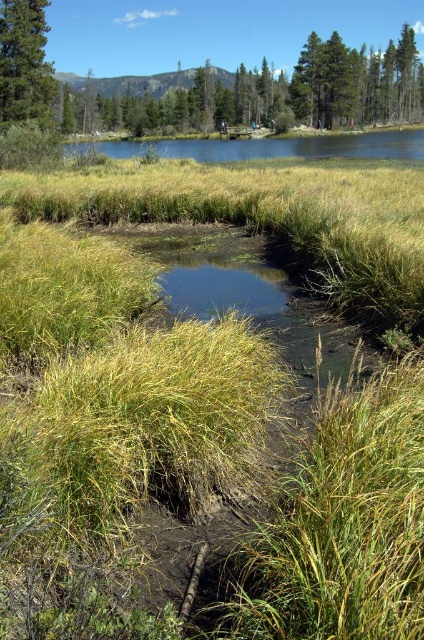
You are an environmental scientist examining the wetland area. You notice two trees in the distance. Which tree, the green leafy tree at upper center or the green matte tree at upper left, has a greater height?

The green leafy tree at upper center is larger in size than the green matte tree at upper left, so it has a greater height.

You are an environmental researcher observing the wetland. You notice two trees in the distance. The green leafy tree at upper center and the green matte tree at upper left. Which tree is closer to you?

The green leafy tree at upper center is closer because the green matte tree at upper left is positioned behind it.

You are standing at the point with coordinates point (259, 92) in the marshy wetland scene. Looking around, you notice a green leafy tree at upper center. Is the tree located above or below the point you are standing at?

The point (259, 92) corresponds to the green leafy tree at upper center, so the tree is exactly at the point you are standing at.